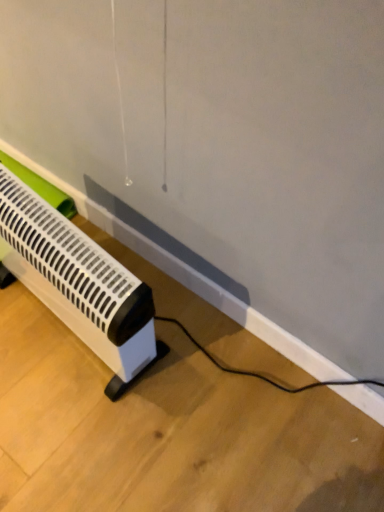
Find the location of a particular element. The height and width of the screenshot is (512, 384). unoccupied area in front of white plastic heater at lower left is located at coordinates (70, 423).